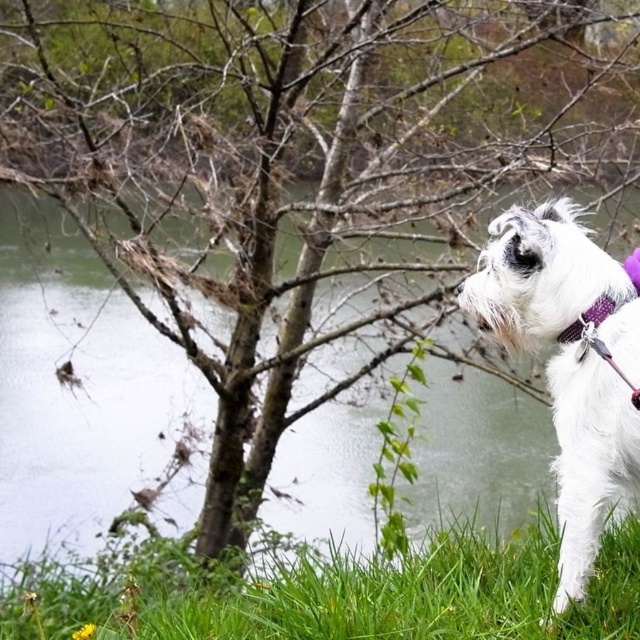
You are standing at the point marked as point (340, 595). What is the object located at that point?

The green grass at lower right is located at point (340, 595).

You are standing at the center of the image and want to walk towards the green grass at lower right. Based on the coordinates provided, in which general direction should you move?

The green grass at lower right is located at coordinates point (x=340, y=595). Since the x and y coordinates are both greater than 0.5, you should move towards the lower right direction to reach it.